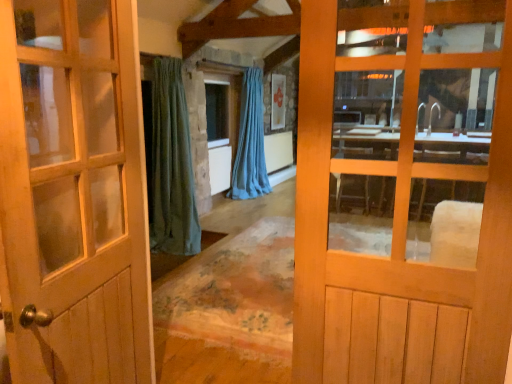
Question: From a real-world perspective, relative to light brown wooden door at center, which is counted as the 2th door, starting from the left, is matte wooden door at center, positioned as the 2th door in right-to-left order, vertically above or below?

Choices:
 (A) above
 (B) below

Answer: (B)

Question: From the image's perspective, relative to light brown wooden door at center, which is counted as the 2th door, starting from the left, is matte wooden door at center, positioned as the 2th door in right-to-left order, above or below?

Choices:
 (A) above
 (B) below

Answer: (B)

Question: Which object is positioned farthest from the clear glass window at center?

Choices:
 (A) blue fabric curtain at center
 (B) light brown wooden door at center, acting as the 1th door starting from the right
 (C) matte wooden door at center, the first door in the left-to-right sequence

Answer: (B)

Question: Considering the real-world distances, which object is farthest from the clear glass window at center?

Choices:
 (A) matte wooden door at center, positioned as the 2th door in right-to-left order
 (B) light brown wooden door at center, acting as the 1th door starting from the right
 (C) blue fabric curtain at center

Answer: (B)